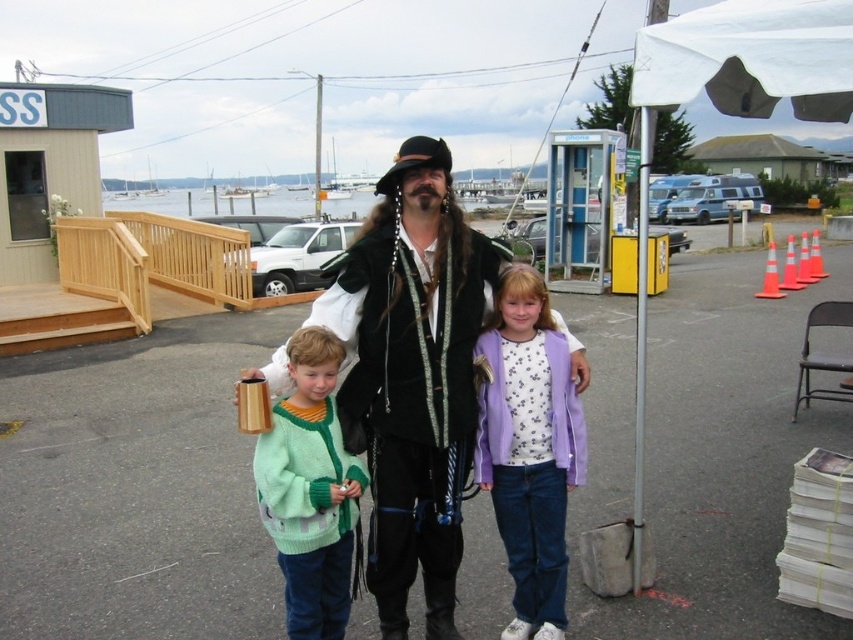
Is point (448, 545) farther from viewer compared to point (488, 333)?

No.

What do you see at coordinates (412, 374) in the screenshot? Image resolution: width=853 pixels, height=640 pixels. I see `shiny black vest at center` at bounding box center [412, 374].

Identify the location of shiny black vest at center. (412, 374).

Does purple cotton jacket at center appear under green knitted sweater at center?

Incorrect, purple cotton jacket at center is not positioned below green knitted sweater at center.

Is purple cotton jacket at center closer to camera compared to green knitted sweater at center?

No, purple cotton jacket at center is further to the viewer.

You are a GUI agent. You are given a task and a screenshot of the screen. Output one action in this format:
    pyautogui.click(x=<x>, y=<y>)
    Task: Click on the purple cotton jacket at center
    The height and width of the screenshot is (640, 853).
    Given the screenshot: What is the action you would take?
    pyautogui.click(x=529, y=448)

Between shiny black vest at center and green knitted sweater at center, which one is positioned higher?

shiny black vest at center is above.

Between point (376, 568) and point (296, 339), which one is positioned in front?

Positioned in front is point (296, 339).

Is point (445, 433) positioned before point (277, 436)?

No, it is not.

Identify the location of shiny black vest at center. (412, 374).